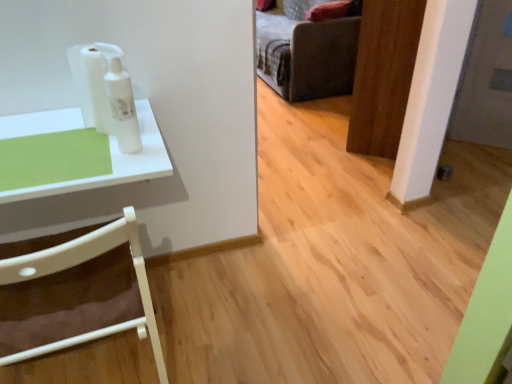
Question: Is white glossy lotion at upper left facing towards dark gray fabric couch at upper center?

Choices:
 (A) yes
 (B) no

Answer: (B)

Question: From the image's perspective, does white glossy lotion at upper left appear lower than dark gray fabric couch at upper center?

Choices:
 (A) no
 (B) yes

Answer: (B)

Question: Is white glossy lotion at upper left positioned with its back to dark gray fabric couch at upper center?

Choices:
 (A) yes
 (B) no

Answer: (B)

Question: Is white glossy lotion at upper left located outside dark gray fabric couch at upper center?

Choices:
 (A) no
 (B) yes

Answer: (B)

Question: Is white glossy lotion at upper left smaller than dark gray fabric couch at upper center?

Choices:
 (A) yes
 (B) no

Answer: (A)

Question: Can you confirm if white glossy lotion at upper left is positioned to the left of dark gray fabric couch at upper center?

Choices:
 (A) yes
 (B) no

Answer: (A)

Question: Does wooden door at center have a greater width compared to white plastic chair at left?

Choices:
 (A) yes
 (B) no

Answer: (B)

Question: Considering the relative sizes of wooden door at center and white plastic chair at left in the image provided, is wooden door at center bigger than white plastic chair at left?

Choices:
 (A) yes
 (B) no

Answer: (A)

Question: Considering the relative positions of wooden door at center and white plastic chair at left in the image provided, is wooden door at center to the right of white plastic chair at left from the viewer's perspective?

Choices:
 (A) yes
 (B) no

Answer: (A)

Question: Is wooden door at center thinner than white plastic chair at left?

Choices:
 (A) no
 (B) yes

Answer: (B)

Question: Is wooden door at center positioned beyond the bounds of white plastic chair at left?

Choices:
 (A) yes
 (B) no

Answer: (A)

Question: From a real-world perspective, is wooden door at center physically above white plastic chair at left?

Choices:
 (A) no
 (B) yes

Answer: (B)

Question: Does dark gray fabric couch at upper center have a greater width compared to white glossy lotion at upper left?

Choices:
 (A) no
 (B) yes

Answer: (B)